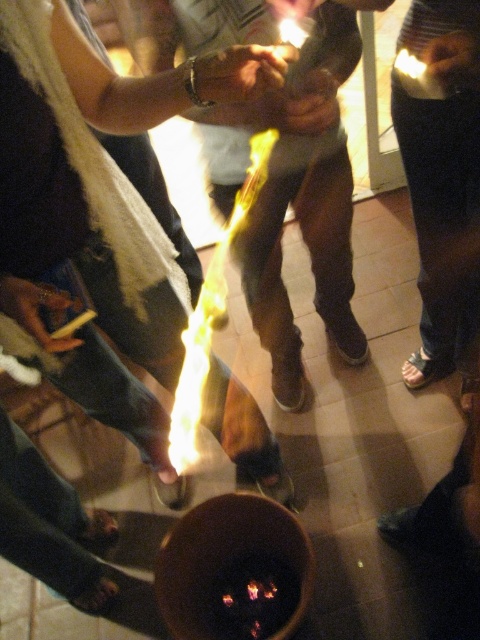
Question: Is fluorescent yellow flame at center thinner than matte black hand at upper right?

Choices:
 (A) yes
 (B) no

Answer: (B)

Question: Is fluorescent yellow flame at center to the left of matte black hand at upper right from the viewer's perspective?

Choices:
 (A) yes
 (B) no

Answer: (A)

Question: Estimate the real-world distances between objects in this image. Which object is closer to the smooth leather bracelet at center?

Choices:
 (A) fluorescent yellow flame at center
 (B) matte black hand at upper right

Answer: (B)

Question: Is the position of smooth leather bracelet at center less distant than that of matte black hand at lower left?

Choices:
 (A) yes
 (B) no

Answer: (A)

Question: Which point is farther to the camera?

Choices:
 (A) (459, 84)
 (B) (296, 13)

Answer: (B)

Question: Which point appears closest to the camera in this image?

Choices:
 (A) (285, 4)
 (B) (227, 100)

Answer: (B)